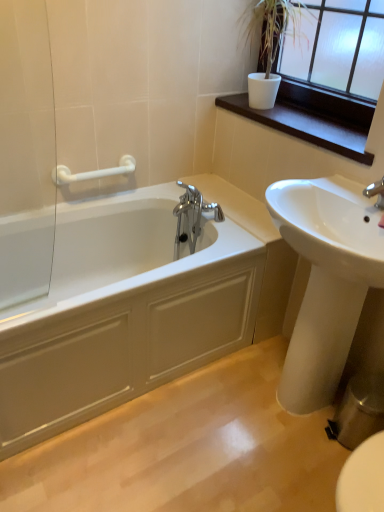
Question: Considering the relative sizes of dark brown wood at upper right and white plastic grab bar at upper left in the image provided, is dark brown wood at upper right thinner than white plastic grab bar at upper left?

Choices:
 (A) yes
 (B) no

Answer: (B)

Question: Is dark brown wood at upper right at the right side of white plastic grab bar at upper left?

Choices:
 (A) no
 (B) yes

Answer: (B)

Question: Could white plastic grab bar at upper left be considered to be inside dark brown wood at upper right?

Choices:
 (A) no
 (B) yes

Answer: (A)

Question: Considering the relative positions of dark brown wood at upper right and white plastic grab bar at upper left in the image provided, is dark brown wood at upper right to the left of white plastic grab bar at upper left from the viewer's perspective?

Choices:
 (A) no
 (B) yes

Answer: (A)

Question: Can you confirm if dark brown wood at upper right is bigger than white plastic grab bar at upper left?

Choices:
 (A) yes
 (B) no

Answer: (A)

Question: Based on their sizes in the image, would you say dark wood window sill at upper right is bigger or smaller than white glossy bathtub at left?

Choices:
 (A) big
 (B) small

Answer: (B)

Question: From a real-world perspective, is dark wood window sill at upper right above or below white glossy bathtub at left?

Choices:
 (A) below
 (B) above

Answer: (B)

Question: Is point (352, 101) closer or farther from the camera than point (160, 292)?

Choices:
 (A) closer
 (B) farther

Answer: (B)

Question: Is dark wood window sill at upper right situated inside white glossy bathtub at left or outside?

Choices:
 (A) inside
 (B) outside

Answer: (B)

Question: From a real-world perspective, is dark wood window sill at upper right physically located above or below white glossy sink at lower right?

Choices:
 (A) above
 (B) below

Answer: (A)

Question: In terms of width, does dark wood window sill at upper right look wider or thinner when compared to white glossy sink at lower right?

Choices:
 (A) thin
 (B) wide

Answer: (A)

Question: Is dark wood window sill at upper right bigger or smaller than white glossy sink at lower right?

Choices:
 (A) small
 (B) big

Answer: (A)

Question: Considering the relative positions of dark wood window sill at upper right and white glossy sink at lower right in the image provided, is dark wood window sill at upper right to the left or to the right of white glossy sink at lower right?

Choices:
 (A) left
 (B) right

Answer: (B)

Question: In the image, is white plastic grab bar at upper left positioned in front of or behind white glossy sink at lower right?

Choices:
 (A) front
 (B) behind

Answer: (B)

Question: Is white plastic grab bar at upper left spatially inside white glossy sink at lower right, or outside of it?

Choices:
 (A) outside
 (B) inside

Answer: (A)